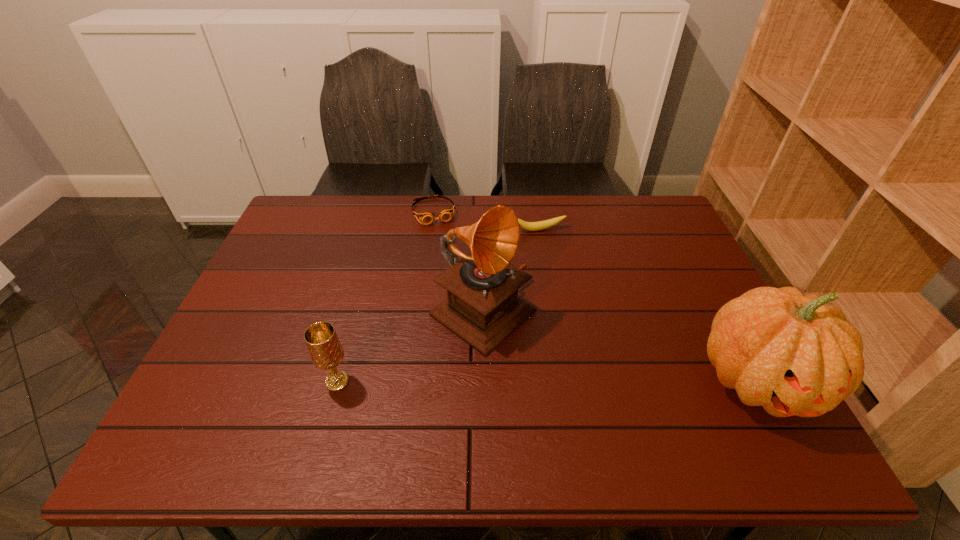
Find the location of a particular element. The width and height of the screenshot is (960, 540). vacant space on the desktop that is between the leftmost object and the second tallest object and is positioned on the horn of the phonograph record is located at coordinates (582, 381).

Identify the location of free space on the desktop that is between the third shortest object and the fourth shortest object and is positioned on the upward curve of the banana. (608, 381).

What are the coordinates of `vacant space on the desktop that is between the third shortest object and the pumpkin and is positioned with the lenses facing forward on the shortest object` in the screenshot? It's located at (489, 381).